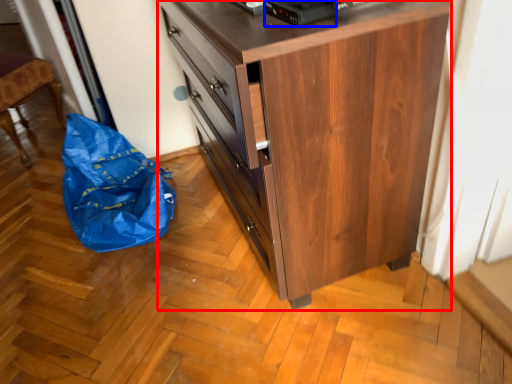
Question: Which point is further to the camera, chest of drawers (highlighted by a red box) or appliance (highlighted by a blue box)?

Choices:
 (A) chest of drawers
 (B) appliance

Answer: (B)